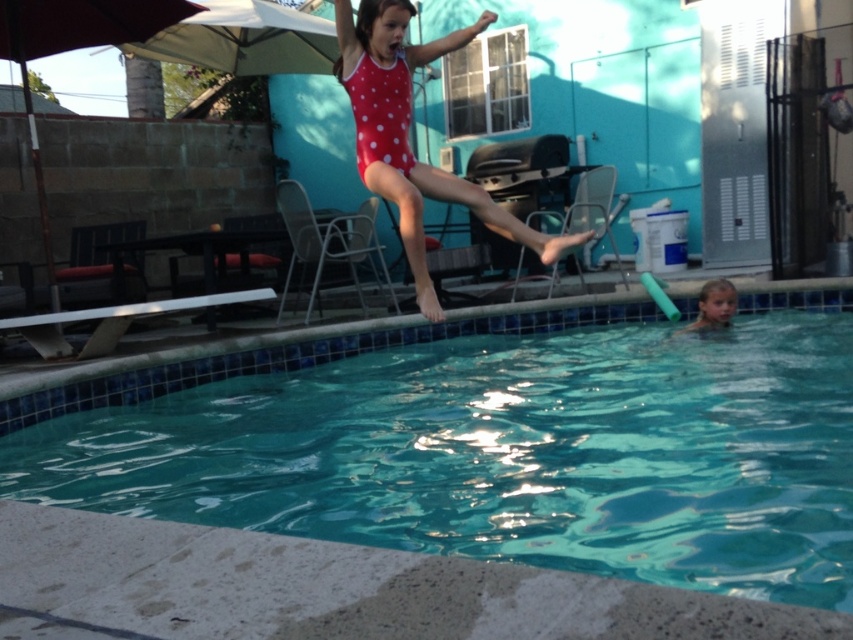
Question: Among these objects, which one is farthest from the camera?

Choices:
 (A) red polka dot swimsuit at upper center
 (B) red fabric umbrella at upper left
 (C) teal glossy water at center
 (D) smooth skin child at lower right

Answer: (B)

Question: Which object appears farthest from the camera in this image?

Choices:
 (A) smooth skin child at lower right
 (B) red fabric umbrella at upper left
 (C) red polka dot swimsuit at upper center
 (D) teal glossy water at center

Answer: (B)

Question: Which of the following is the farthest from the observer?

Choices:
 (A) (351, 484)
 (B) (10, 24)
 (C) (705, 292)

Answer: (B)

Question: Does red fabric umbrella at upper left appear on the left side of smooth skin child at lower right?

Choices:
 (A) no
 (B) yes

Answer: (B)

Question: From the image, what is the correct spatial relationship of teal glossy water at center in relation to smooth skin child at lower right?

Choices:
 (A) above
 (B) below

Answer: (B)

Question: Is teal glossy water at center wider than red polka dot swimsuit at upper center?

Choices:
 (A) no
 (B) yes

Answer: (B)